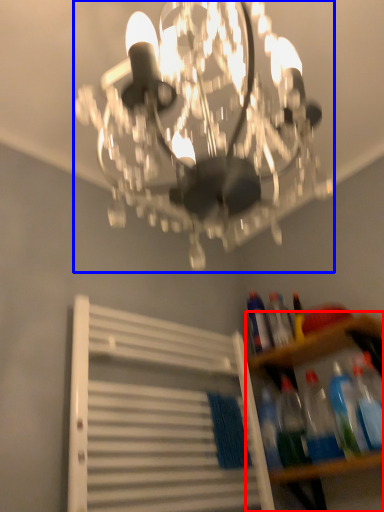
Question: Which of the following is the closest to the observer, shelf (highlighted by a red box) or lamp (highlighted by a blue box)?

Choices:
 (A) shelf
 (B) lamp

Answer: (B)